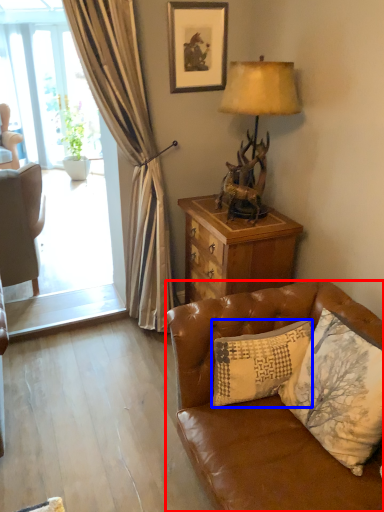
Question: Which of the following is the farthest to the observer, studio couch (highlighted by a red box) or pillow (highlighted by a blue box)?

Choices:
 (A) studio couch
 (B) pillow

Answer: (B)